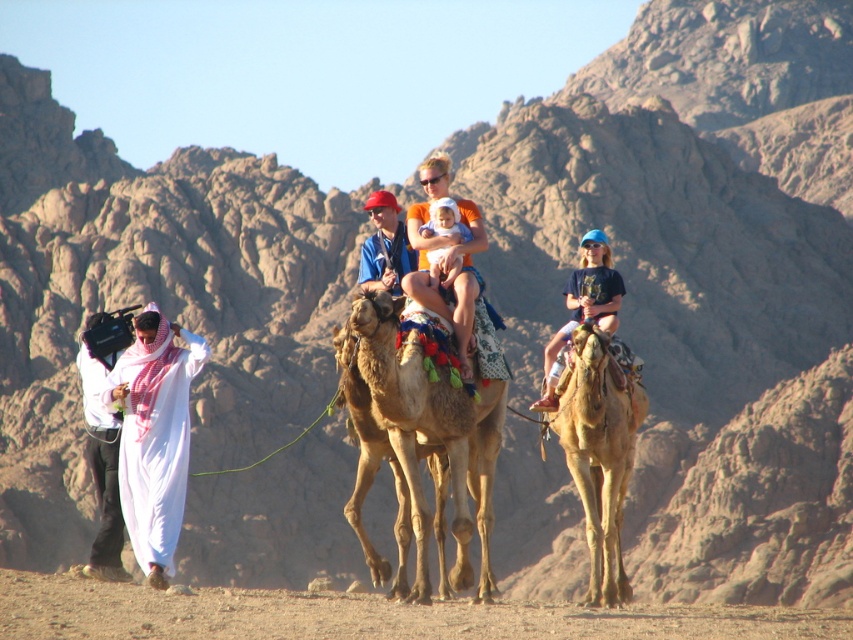
Who is more forward, (440, 428) or (360, 272)?

Positioned in front is point (440, 428).

What are the coordinates of `brown textured camel at center` in the screenshot? It's located at (428, 435).

Describe the element at coordinates (599, 452) in the screenshot. Image resolution: width=853 pixels, height=640 pixels. I see `light brown textured camel at center` at that location.

Between light brown textured camel at center and matte blue shirt at center, which one appears on the left side from the viewer's perspective?

matte blue shirt at center is more to the left.

From the picture: Who is more forward, [612,518] or [404,232]?

Positioned in front is point [612,518].

Where is `light brown textured camel at center`? This screenshot has width=853, height=640. light brown textured camel at center is located at coordinates (599, 452).

Measure the distance between point (91, 417) and camera.

Point (91, 417) is 62.21 meters away from camera.

Who is positioned more to the right, white clothed man at left or blue cotton shirt at right?

blue cotton shirt at right

Which is behind, point (109, 563) or point (595, 314)?

The point (595, 314) is behind.

Image resolution: width=853 pixels, height=640 pixels. Find the location of `white clothed man at left`. white clothed man at left is located at coordinates (102, 467).